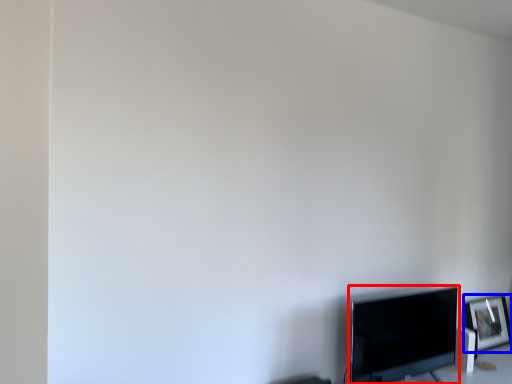
Question: Which point is closer to the camera, television (highlighted by a red box) or picture frame (highlighted by a blue box)?

Choices:
 (A) television
 (B) picture frame

Answer: (A)